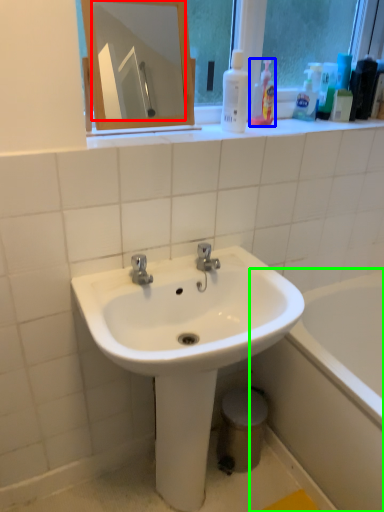
Question: Which object is the farthest from mirror (highlighted by a red box)? Choose among these: cleaning product (highlighted by a blue box) or bathtub (highlighted by a green box).

Choices:
 (A) cleaning product
 (B) bathtub

Answer: (B)